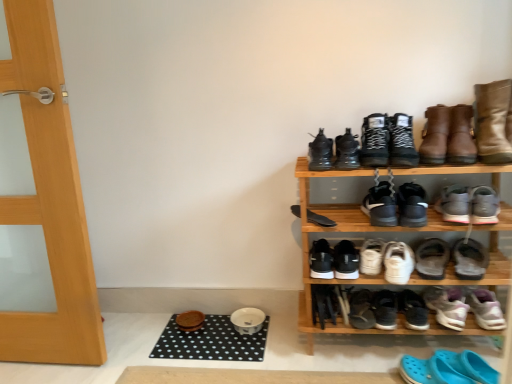
Image resolution: width=512 pixels, height=384 pixels. In order to click on vacant area situated to the left side of black dotted mat at lower center, the first doormat in the back-to-front sequence in this screenshot , I will do `click(130, 340)`.